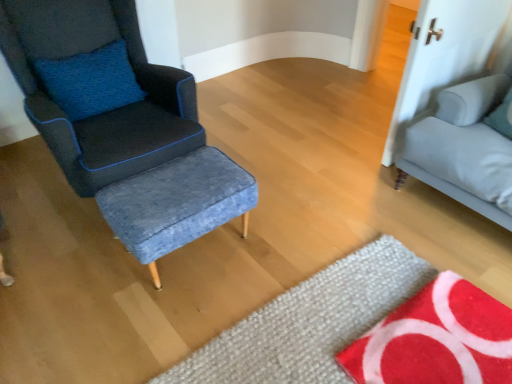
The height and width of the screenshot is (384, 512). In order to click on vacant space in front of denim fabric stool at center in this screenshot , I will do `click(158, 324)`.